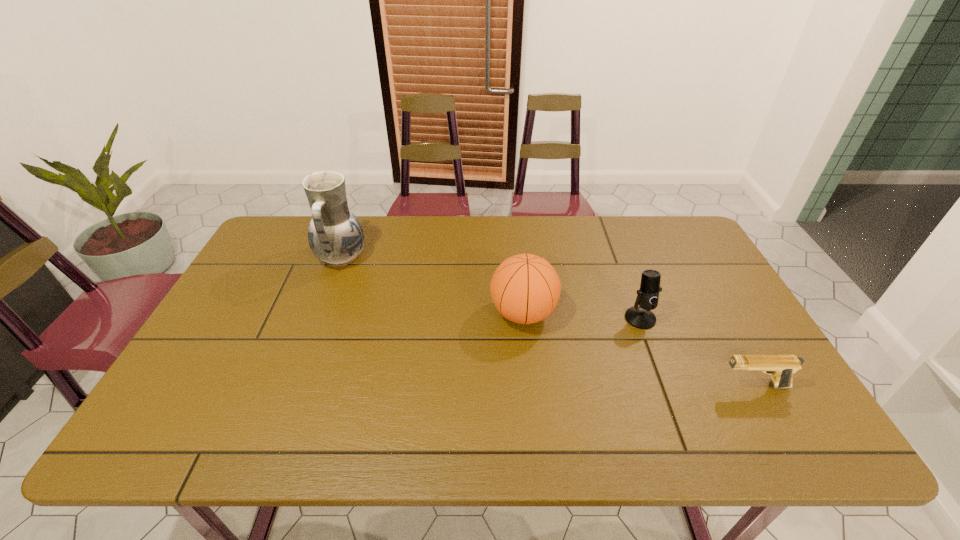
Select which object appears as the closest to the nearest object. Please provide its 2D coordinates. Your answer should be formatted as a tuple, i.e. [(x, y)], where the tuple contains the x and y coordinates of a point satisfying the conditions above.

[(640, 317)]

The image size is (960, 540). I want to click on blank space that satisfies the following two spatial constraints: 1. on the front-facing side of the tallest object; 2. on the right side of the basketball, so click(321, 314).

Locate an element on the screen. The width and height of the screenshot is (960, 540). vacant region that satisfies the following two spatial constraints: 1. on the front-facing side of the farthest object; 2. on the left side of the second object from left to right is located at coordinates (321, 314).